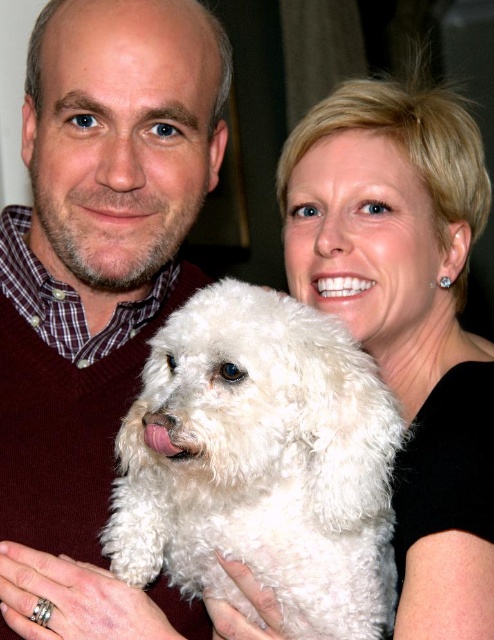
Question: Does matte maroon sweater at left appear under white fluffy dog at center?

Choices:
 (A) no
 (B) yes

Answer: (A)

Question: Can you confirm if matte maroon sweater at left is thinner than white fluffy dog at upper center?

Choices:
 (A) no
 (B) yes

Answer: (A)

Question: Based on their relative distances, which object is farther from the matte maroon sweater at left?

Choices:
 (A) white fluffy dog at center
 (B) white fluffy dog at upper center

Answer: (B)

Question: Among these objects, which one is farthest from the camera?

Choices:
 (A) white fluffy dog at upper center
 (B) white fluffy dog at center
 (C) matte maroon sweater at left

Answer: (C)

Question: Which point appears closest to the camera in this image?

Choices:
 (A) (309, 420)
 (B) (291, 148)
 (C) (164, 276)

Answer: (A)

Question: Can you confirm if matte maroon sweater at left is smaller than white fluffy dog at center?

Choices:
 (A) yes
 (B) no

Answer: (B)